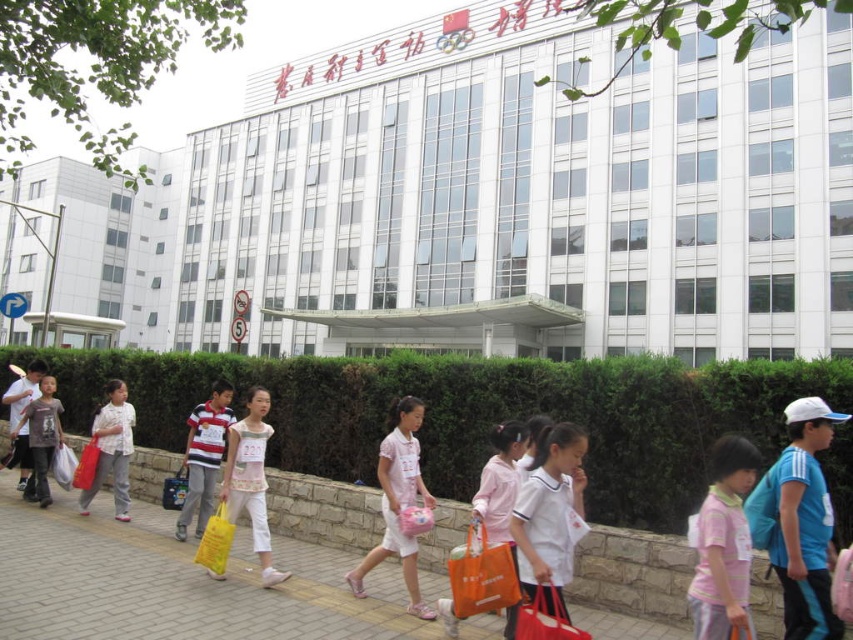
Question: Where is white cotton shirt at center located in relation to striped cotton shirt at center in the image?

Choices:
 (A) below
 (B) above

Answer: (B)

Question: Which object appears closest to the camera in this image?

Choices:
 (A) matte gray shirt at left
 (B) green leafy hedge at center
 (C) striped cotton shirt at center
 (D) pink fabric bag at center

Answer: (D)

Question: Which point is farther to the camera?

Choices:
 (A) orange fabric bag at lower center
 (B) yellow plastic bag at center
 (C) matte gray shirt at left

Answer: (C)

Question: Is white cotton shirt at center positioned in front of pink fabric dress at center?

Choices:
 (A) no
 (B) yes

Answer: (B)

Question: Is orange plastic bag at center positioned at the back of yellow plastic bag at center?

Choices:
 (A) yes
 (B) no

Answer: (B)

Question: Which point is closer to the camera taking this photo?

Choices:
 (A) (529, 474)
 (B) (216, 576)
 (C) (532, 618)
 (D) (44, 406)

Answer: (C)